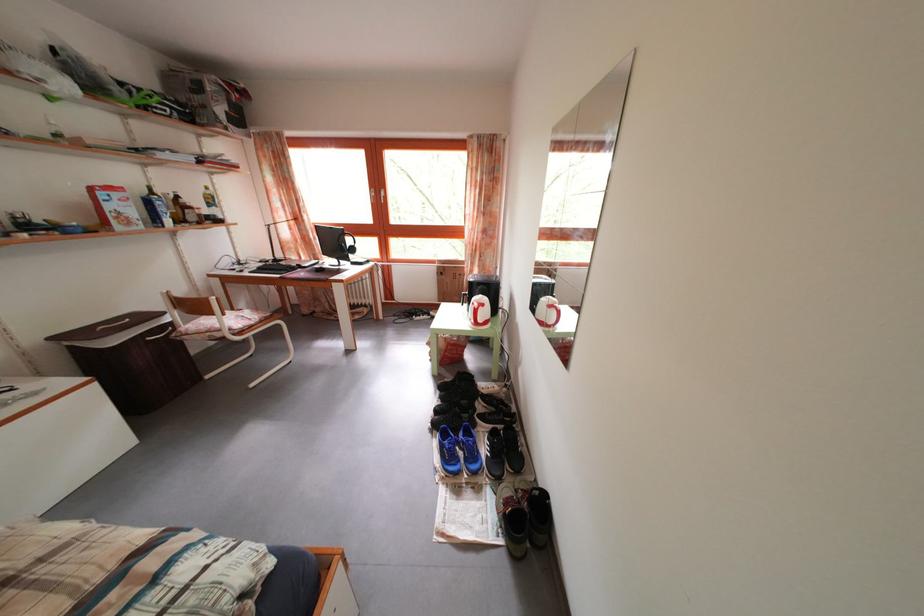
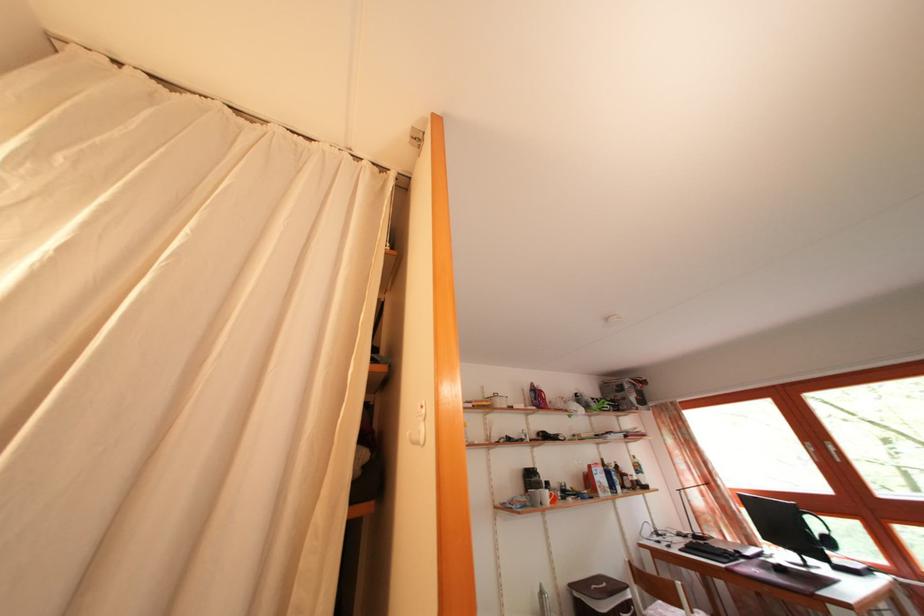
Find the pixel in the second image that matches (202,213) in the first image.

(636, 480)